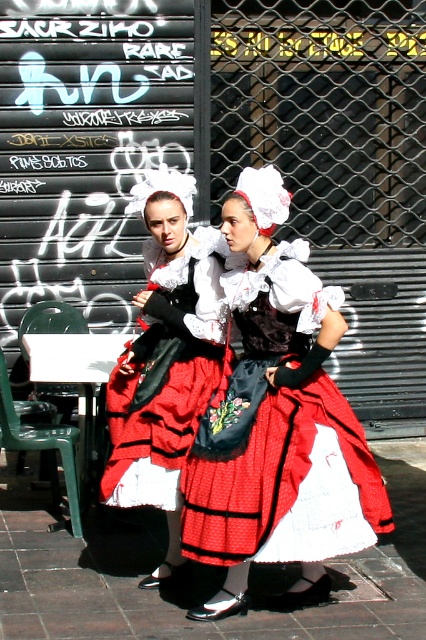
Question: Can you confirm if smooth brick pavement at center is positioned to the right of matte black dress at center?

Choices:
 (A) no
 (B) yes

Answer: (B)

Question: Which point appears closest to the camera in this image?

Choices:
 (A) click(173, 243)
 (B) click(264, 554)

Answer: (B)

Question: Considering the real-world distances, which object is closest to the matte red dress at center?

Choices:
 (A) matte black dress at center
 (B) smooth brick pavement at center

Answer: (A)

Question: Is matte red dress at center bigger than smooth brick pavement at center?

Choices:
 (A) no
 (B) yes

Answer: (A)

Question: Which object appears closest to the camera in this image?

Choices:
 (A) matte black dress at center
 (B) matte red dress at center

Answer: (B)

Question: Does matte red dress at center appear on the left side of smooth brick pavement at center?

Choices:
 (A) no
 (B) yes

Answer: (A)